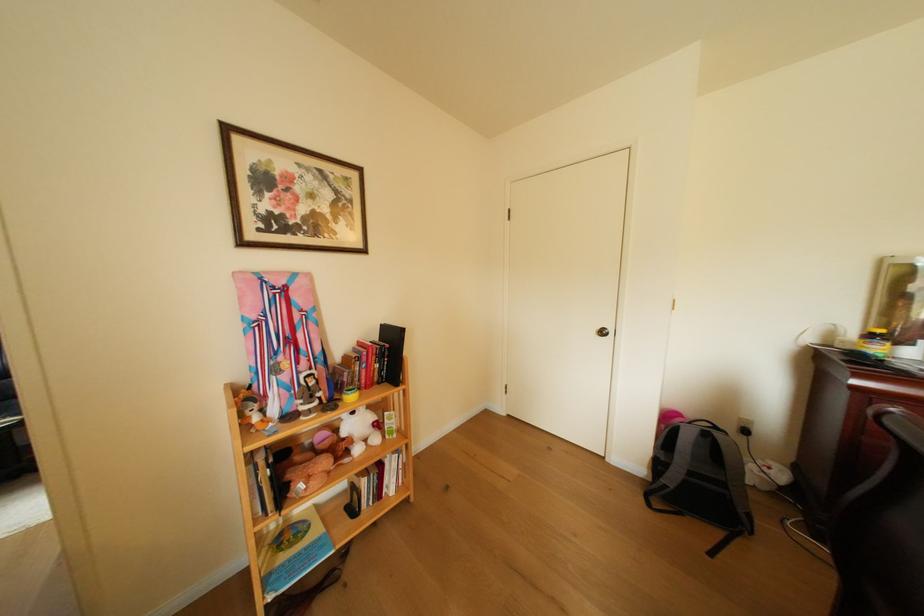
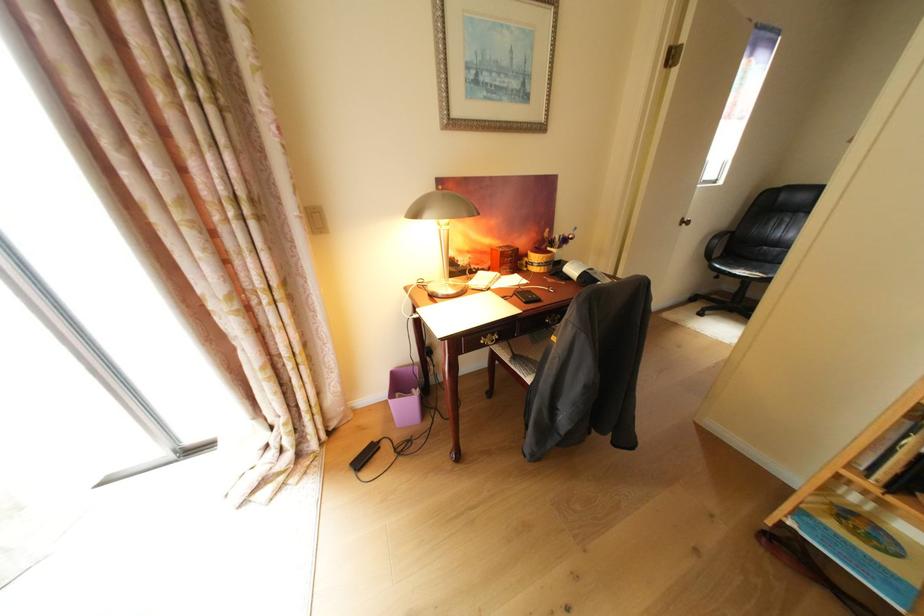
The first image is from the beginning of the video and the second image is from the end. How did the camera likely rotate when shooting the video?

The rotation direction of the camera is left-down.